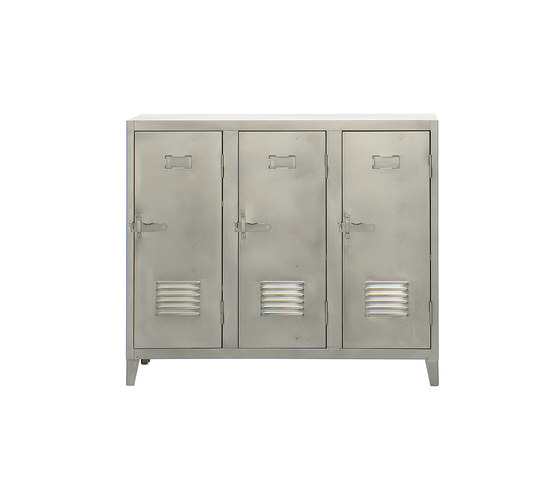
I want to click on right door, so click(x=399, y=220).